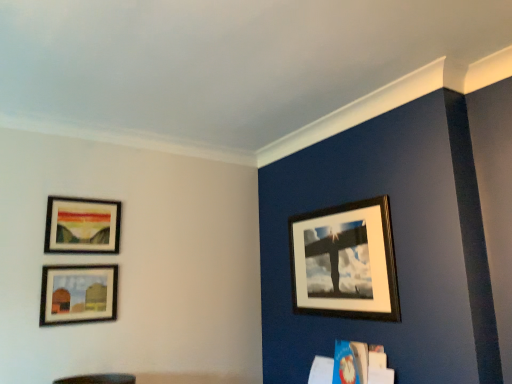
Question: From a real-world perspective, is wooden picture frame at upper right, the 1th picture frame positioned from the right, physically above matte wooden picture frame at upper left, the 1th picture frame viewed from the left?

Choices:
 (A) yes
 (B) no

Answer: (B)

Question: Is wooden picture frame at upper right, the 1th picture frame positioned from the right, in contact with matte wooden picture frame at upper left, the 1th picture frame viewed from the left?

Choices:
 (A) yes
 (B) no

Answer: (B)

Question: Does wooden picture frame at upper right, the 3th picture frame viewed from the left, have a lesser width compared to matte wooden picture frame at upper left, the 3th picture frame in the right-to-left sequence?

Choices:
 (A) yes
 (B) no

Answer: (B)

Question: Are wooden picture frame at upper right, the 1th picture frame positioned from the right, and matte wooden picture frame at upper left, the 1th picture frame viewed from the left, located far from each other?

Choices:
 (A) no
 (B) yes

Answer: (B)

Question: From the image's perspective, is wooden picture frame at upper right, the 3th picture frame viewed from the left, on top of matte wooden picture frame at upper left, the 3th picture frame in the right-to-left sequence?

Choices:
 (A) no
 (B) yes

Answer: (A)

Question: Does wooden picture frame at upper right, the 3th picture frame viewed from the left, have a smaller size compared to matte wooden picture frame at upper left, the 1th picture frame viewed from the left?

Choices:
 (A) no
 (B) yes

Answer: (A)

Question: Considering the relative sizes of matte wooden picture frame at lower left, the second picture frame in the right-to-left sequence, and wooden picture frame at upper right, the 3th picture frame viewed from the left, in the image provided, is matte wooden picture frame at lower left, the second picture frame in the right-to-left sequence, bigger than wooden picture frame at upper right, the 3th picture frame viewed from the left,?

Choices:
 (A) no
 (B) yes

Answer: (A)

Question: Is matte wooden picture frame at lower left, the 2th picture frame viewed from the left, thinner than wooden picture frame at upper right, the 3th picture frame viewed from the left?

Choices:
 (A) no
 (B) yes

Answer: (B)

Question: Considering the relative sizes of matte wooden picture frame at lower left, the 2th picture frame viewed from the left, and wooden picture frame at upper right, the 3th picture frame viewed from the left, in the image provided, is matte wooden picture frame at lower left, the 2th picture frame viewed from the left, wider than wooden picture frame at upper right, the 3th picture frame viewed from the left,?

Choices:
 (A) no
 (B) yes

Answer: (A)

Question: Considering the relative sizes of matte wooden picture frame at lower left, the second picture frame in the right-to-left sequence, and wooden picture frame at upper right, the 3th picture frame viewed from the left, in the image provided, is matte wooden picture frame at lower left, the second picture frame in the right-to-left sequence, shorter than wooden picture frame at upper right, the 3th picture frame viewed from the left,?

Choices:
 (A) no
 (B) yes

Answer: (B)

Question: Could you tell me if matte wooden picture frame at lower left, the second picture frame in the right-to-left sequence, is facing wooden picture frame at upper right, the 3th picture frame viewed from the left?

Choices:
 (A) yes
 (B) no

Answer: (B)

Question: From the image's perspective, would you say matte wooden picture frame at lower left, the second picture frame in the right-to-left sequence, is positioned over wooden picture frame at upper right, the 1th picture frame positioned from the right?

Choices:
 (A) no
 (B) yes

Answer: (A)

Question: From the image's perspective, is matte wooden picture frame at upper left, the 3th picture frame in the right-to-left sequence, below matte wooden picture frame at lower left, the second picture frame in the right-to-left sequence?

Choices:
 (A) yes
 (B) no

Answer: (B)